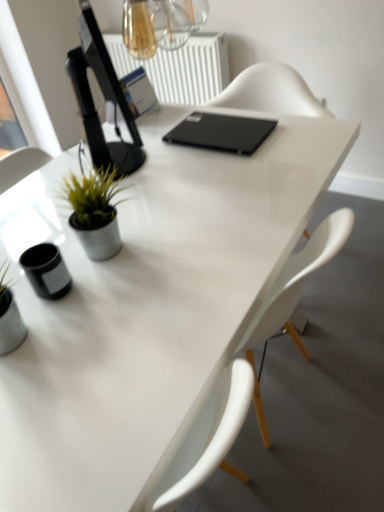
The image size is (384, 512). In order to click on vacant area that lies between black matte laptop at center and green matte plant at left in this screenshot , I will do tap(167, 178).